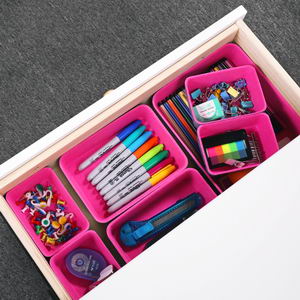
The image size is (300, 300). In order to click on markers in this screenshot , I will do `click(124, 132)`, `click(131, 138)`, `click(139, 141)`, `click(148, 144)`, `click(154, 150)`, `click(159, 157)`, `click(165, 163)`, `click(168, 170)`.